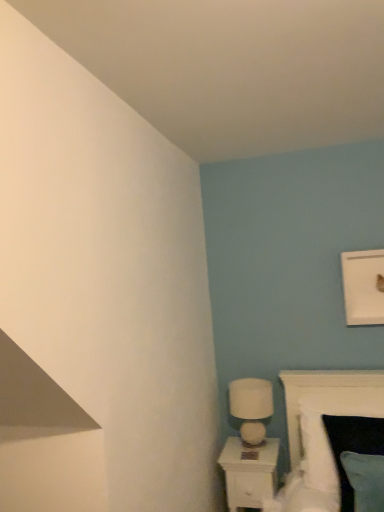
Where is `white glossy table lamp at lower right`? The height and width of the screenshot is (512, 384). white glossy table lamp at lower right is located at coordinates (251, 407).

Looking at this image, considering the sizes of objects white soft bed at lower right and white glossy nightstand at lower right in the image provided, who is wider, white soft bed at lower right or white glossy nightstand at lower right?

With larger width is white soft bed at lower right.

The width and height of the screenshot is (384, 512). I want to click on nightstand that is behind the white soft bed at lower right, so click(249, 472).

From the image's perspective, does white soft bed at lower right appear lower than white glossy nightstand at lower right?

No, from the image's perspective, white soft bed at lower right is not beneath white glossy nightstand at lower right.

Can you tell me how much white soft bed at lower right and white glossy nightstand at lower right differ in facing direction?

The angular difference between white soft bed at lower right and white glossy nightstand at lower right is 1.78 degrees.

Does point (234, 437) come farther from viewer compared to point (302, 506)?

Yes, point (234, 437) is behind point (302, 506).

Does white glossy nightstand at lower right have a lesser width compared to white soft bed at lower right?

Correct, the width of white glossy nightstand at lower right is less than that of white soft bed at lower right.

Is white glossy nightstand at lower right facing towards white soft bed at lower right?

No, white glossy nightstand at lower right is not oriented towards white soft bed at lower right.

From a real-world perspective, is white glossy nightstand at lower right physically above white soft bed at lower right?

No, from a real-world perspective, white glossy nightstand at lower right is not above white soft bed at lower right.

Based on their sizes in the image, would you say white glossy nightstand at lower right is bigger or smaller than white glossy table lamp at lower right?

→ Considering their sizes, white glossy nightstand at lower right takes up more space than white glossy table lamp at lower right.

Is white glossy nightstand at lower right to the left of white glossy table lamp at lower right from the viewer's perspective?

Indeed, white glossy nightstand at lower right is positioned on the left side of white glossy table lamp at lower right.

In terms of height, does white glossy nightstand at lower right look taller or shorter compared to white glossy table lamp at lower right?

white glossy nightstand at lower right is taller than white glossy table lamp at lower right.

Considering the sizes of objects white glossy nightstand at lower right and white glossy table lamp at lower right in the image provided, who is wider, white glossy nightstand at lower right or white glossy table lamp at lower right?

white glossy nightstand at lower right is wider.

Which object is closer to the camera, white soft bed at lower right or white glossy table lamp at lower right?

Positioned in front is white soft bed at lower right.

Does white soft bed at lower right have a lesser width compared to white glossy table lamp at lower right?

In fact, white soft bed at lower right might be wider than white glossy table lamp at lower right.

Do you think white soft bed at lower right is within white glossy table lamp at lower right, or outside of it?

white soft bed at lower right exists outside the volume of white glossy table lamp at lower right.

Does white soft bed at lower right turn towards white glossy table lamp at lower right?

No, white soft bed at lower right does not turn towards white glossy table lamp at lower right.

Would you say white glossy table lamp at lower right contains white soft bed at lower right?

No, white soft bed at lower right is not inside white glossy table lamp at lower right.

Is white glossy table lamp at lower right far away from white soft bed at lower right?

No, white glossy table lamp at lower right is not far from white soft bed at lower right.

From a real-world perspective, is white glossy table lamp at lower right above or below white soft bed at lower right?

white glossy table lamp at lower right is situated higher than white soft bed at lower right in the real world.

Could you tell me if white glossy table lamp at lower right is turned towards white glossy nightstand at lower right?

No, white glossy table lamp at lower right is not facing towards white glossy nightstand at lower right.

What's the angular difference between white glossy table lamp at lower right and white glossy nightstand at lower right's facing directions?

0.00426 degrees separate the facing orientations of white glossy table lamp at lower right and white glossy nightstand at lower right.

Would you say white glossy table lamp at lower right is to the left or to the right of white glossy nightstand at lower right in the picture?

white glossy table lamp at lower right is to the right of white glossy nightstand at lower right.

Considering the relative sizes of white glossy table lamp at lower right and white glossy nightstand at lower right in the image provided, is white glossy table lamp at lower right taller than white glossy nightstand at lower right?

No, white glossy table lamp at lower right is not taller than white glossy nightstand at lower right.

The width and height of the screenshot is (384, 512). What are the coordinates of `bed in front of the white glossy nightstand at lower right` in the screenshot? It's located at (321, 432).

Find the location of `nightstand below the white soft bed at lower right (from a real-world perspective)`. nightstand below the white soft bed at lower right (from a real-world perspective) is located at coordinates (249, 472).

Looking at the image, which one is located closer to white soft bed at lower right, white glossy nightstand at lower right or white glossy table lamp at lower right?

Based on the image, white glossy nightstand at lower right appears to be nearer to white soft bed at lower right.

Based on their spatial positions, is white glossy table lamp at lower right or white soft bed at lower right further from white glossy nightstand at lower right?

The object further to white glossy nightstand at lower right is white soft bed at lower right.

Consider the image. Estimate the real-world distances between objects in this image. Which object is closer to white glossy table lamp at lower right, white soft bed at lower right or white glossy nightstand at lower right?

Among the two, white glossy nightstand at lower right is located nearer to white glossy table lamp at lower right.

Looking at the image, which one is located closer to white soft bed at lower right, white glossy table lamp at lower right or white glossy nightstand at lower right?

white glossy nightstand at lower right lies closer to white soft bed at lower right than the other object.

From the image, which object appears to be farther from white glossy nightstand at lower right, white soft bed at lower right or white glossy table lamp at lower right?

white soft bed at lower right lies further to white glossy nightstand at lower right than the other object.

Based on their spatial positions, is white glossy nightstand at lower right or white soft bed at lower right closer to white glossy table lamp at lower right?

white glossy nightstand at lower right is closer to white glossy table lamp at lower right.

You are a GUI agent. You are given a task and a screenshot of the screen. Output one action in this format:
    pyautogui.click(x=<x>, y=<y>)
    Task: Click on the table lamp between white glossy nightstand at lower right and white soft bed at lower right
    This screenshot has height=512, width=384.
    Given the screenshot: What is the action you would take?
    pyautogui.click(x=251, y=407)